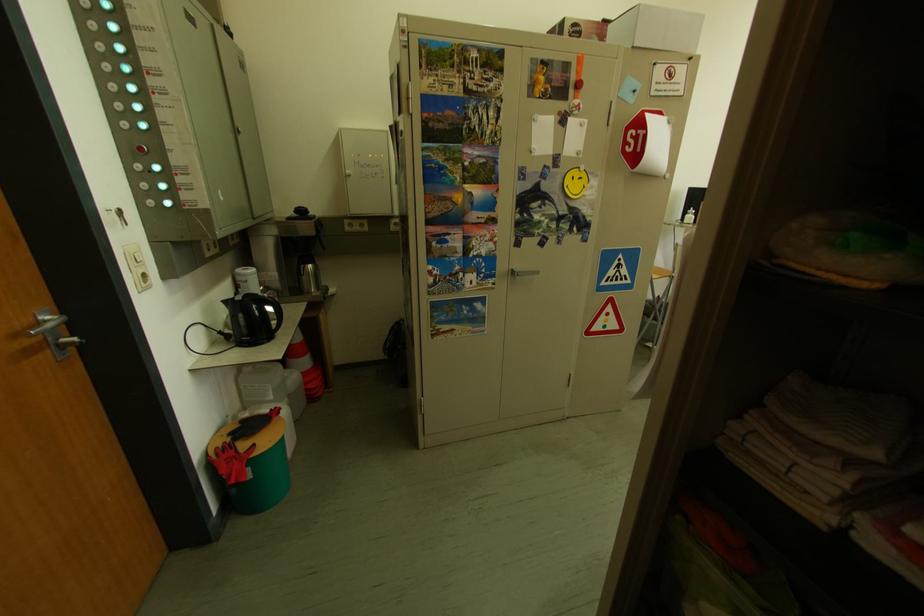
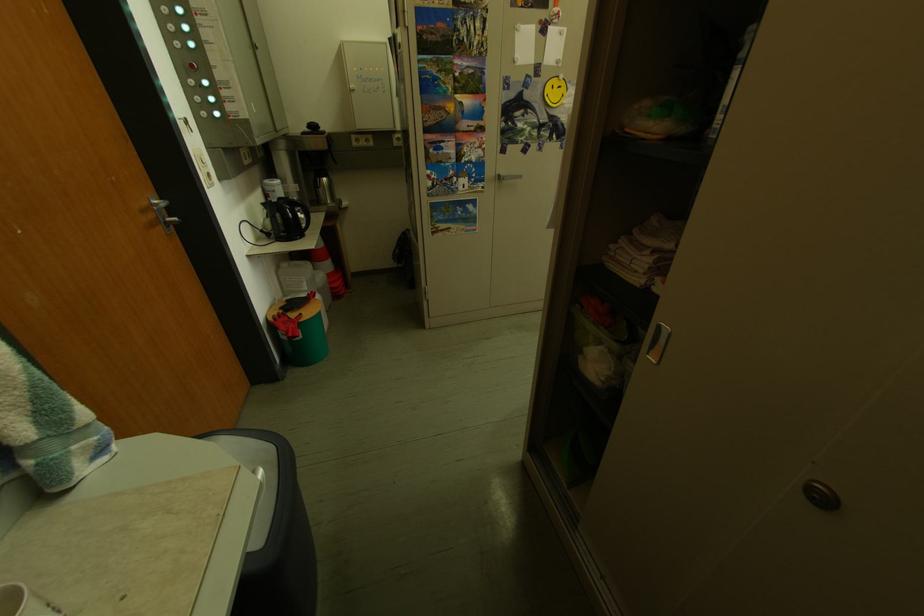
Find the pixel in the second image that matches (252,318) in the first image.

(290, 217)